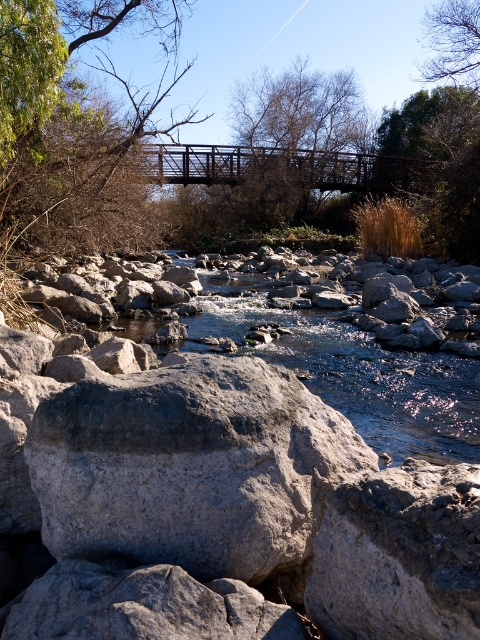
Question: Can you confirm if gray rock at center is positioned above brown leafy tree at upper center?

Choices:
 (A) no
 (B) yes

Answer: (A)

Question: Is gray rock at center further to the viewer compared to brown leafy tree at upper center?

Choices:
 (A) yes
 (B) no

Answer: (B)

Question: Which is farther from the brown leafy tree at upper center?

Choices:
 (A) green leafy tree at upper right
 (B) gray rock at center

Answer: (B)

Question: Estimate the real-world distances between objects in this image. Which object is farther from the green leafy tree at upper right?

Choices:
 (A) gray rock at center
 (B) brown leafy tree at upper center

Answer: (A)

Question: Is gray rock at center smaller than green leafy tree at upper right?

Choices:
 (A) yes
 (B) no

Answer: (B)

Question: Which is nearer to the gray rock at center?

Choices:
 (A) brown leafy tree at upper center
 (B) green leafy tree at upper right

Answer: (B)